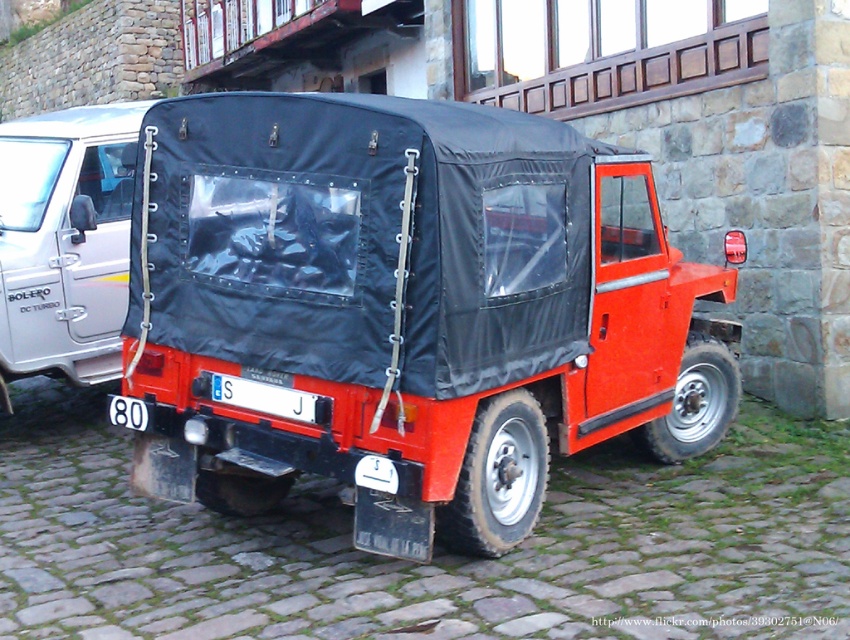
Which is above, matte black truck at center or matte black car at right?

matte black car at right

Between point (191, 397) and point (3, 378), which one is positioned in front?

Positioned in front is point (191, 397).

Locate an element on the screen. matte black truck at center is located at coordinates (406, 310).

Between point (166, 157) and point (290, 396), which one is positioned behind?

The point (166, 157) is more distant.

Can you confirm if matte black truck at center is positioned below white plastic license plate at center?

Actually, matte black truck at center is above white plastic license plate at center.

Between point (327, 108) and point (252, 388), which one is positioned behind?

Positioned behind is point (252, 388).

In order to click on matte black truck at center in this screenshot , I will do `click(406, 310)`.

Is point (64, 364) positioned before point (216, 372)?

No, (64, 364) is behind (216, 372).

Who is positioned more to the left, matte black car at right or white plastic license plate at center?

matte black car at right

Who is more forward, (65, 353) or (278, 396)?

Point (278, 396) is more forward.

Identify the location of matte black car at right. (64, 241).